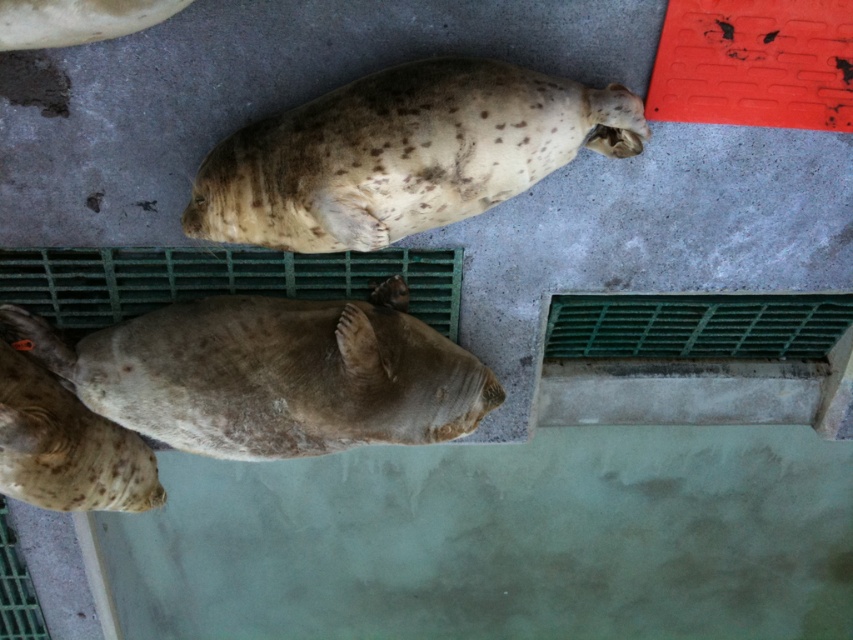
Can you confirm if speckled fur seal at lower left is taller than speckled fur seal at upper left?

Indeed, speckled fur seal at lower left has a greater height compared to speckled fur seal at upper left.

Which is behind, point (55, 465) or point (18, 19)?

Point (55, 465)

Find the location of `speckled fur seal at lower left`. speckled fur seal at lower left is located at coordinates (67, 445).

Does speckled fur seal at upper center appear on the left side of speckled fur seal at center?

In fact, speckled fur seal at upper center is to the right of speckled fur seal at center.

Looking at this image, how far apart are speckled fur seal at upper center and speckled fur seal at center?

A distance of 13.41 inches exists between speckled fur seal at upper center and speckled fur seal at center.

Between point (428, 77) and point (358, 342), which one is positioned in front?

Point (428, 77) is more forward.

Locate an element on the screen. The image size is (853, 640). speckled fur seal at upper center is located at coordinates (402, 154).

Is speckled fur seal at upper center above speckled fur seal at lower left?

Correct, speckled fur seal at upper center is located above speckled fur seal at lower left.

Does point (436, 176) lie behind point (18, 372)?

That is False.

Does point (328, 209) come behind point (68, 412)?

No, (328, 209) is closer to viewer.

The width and height of the screenshot is (853, 640). Identify the location of speckled fur seal at upper center. (402, 154).